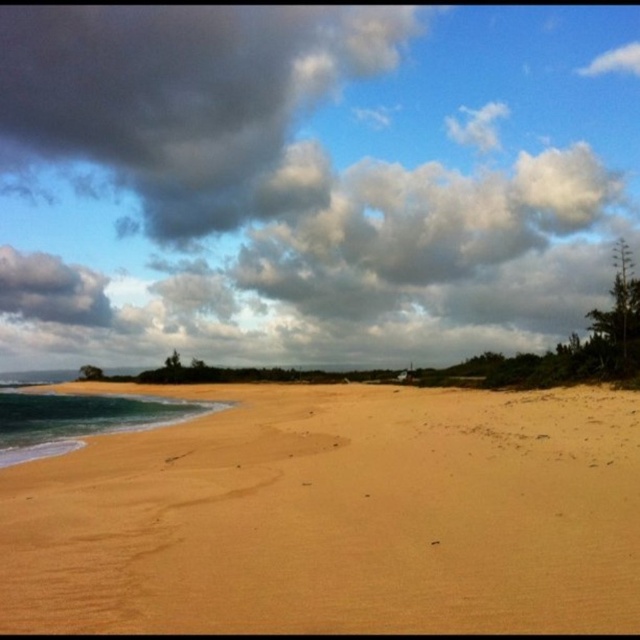
You are standing on the beach and looking towards the ocean. There is a dark gray cloud at upper left. Can you see the cloud while facing the ocean?

Yes, the dark gray cloud at upper left is located at point upper left, so you can see it while facing the ocean.

You are standing on the beach looking towards the ocean. You see a dark gray cloud at upper left and a blue glossy water at lower left. Which object is positioned to the left of the other?

The dark gray cloud at upper left is positioned to the left of the blue glossy water at lower left.